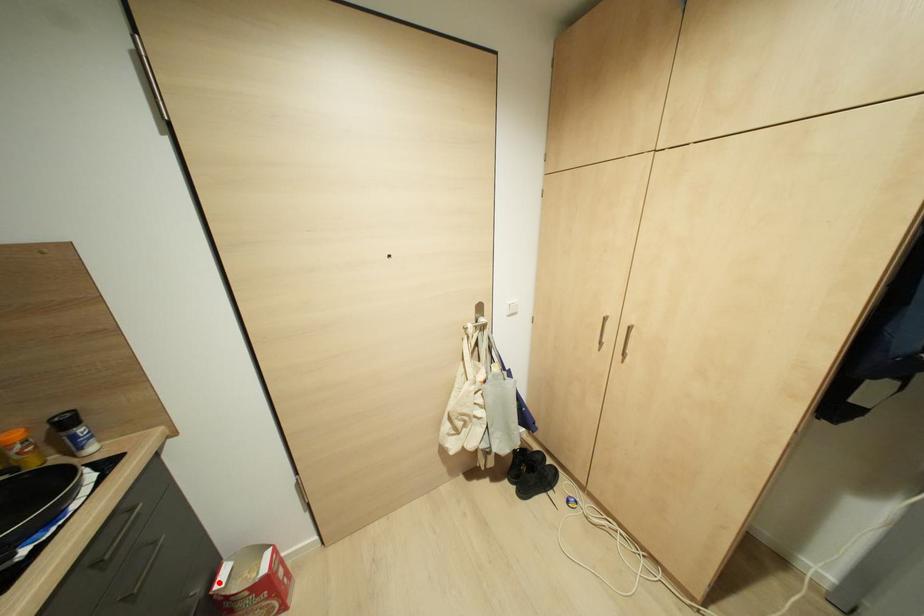
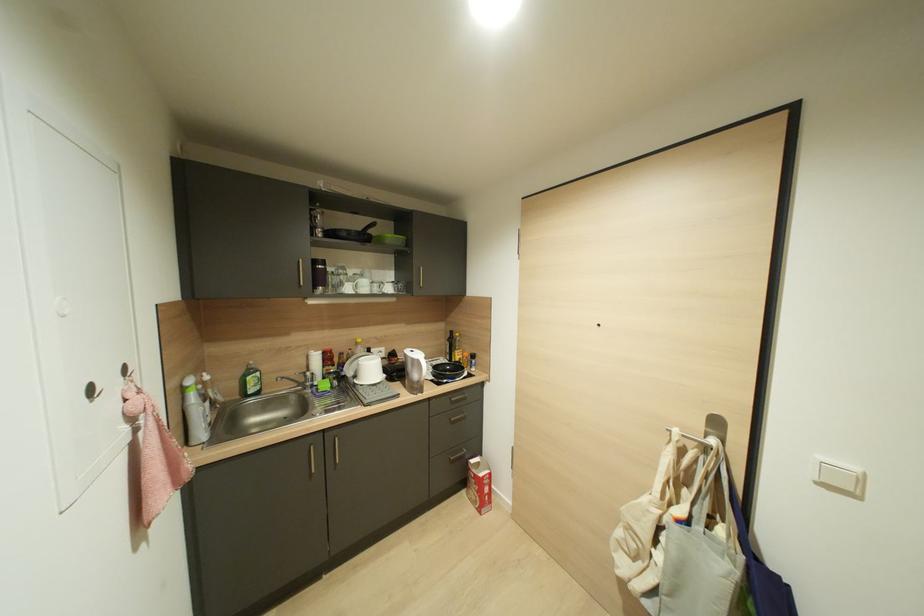
Where in the second image is the point corresponding to the highlighted location from the first image?

(470, 460)